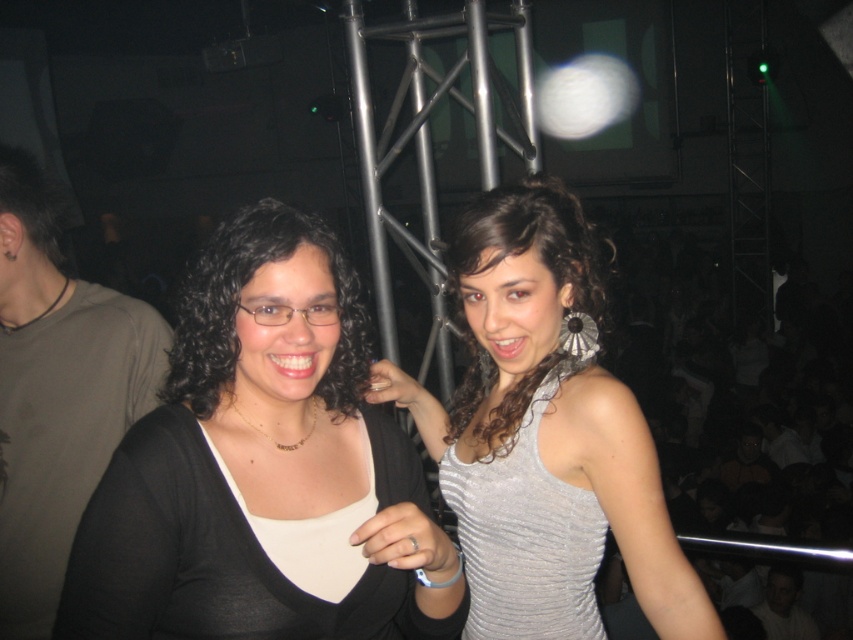
You are a photographer at the event and need to ensure both the matte black shirt at center and the matte black hair at center are clearly visible in your photo. Based on their widths, which object should you focus on first to ensure proper framing?

The matte black shirt at center is wider than the matte black hair at center. To ensure proper framing, focus on the matte black shirt at center first since it occupies more space in the frame.

You are organizing a charity event and need to decide which item to feature more prominently in the promotional materials. The matte black shirt at left and the matte black hair at center are both candidates. Based on their sizes, which item should you highlight to draw more attention?

The matte black shirt at left should be highlighted because it has a larger size compared to the matte black hair at center, making it more noticeable.